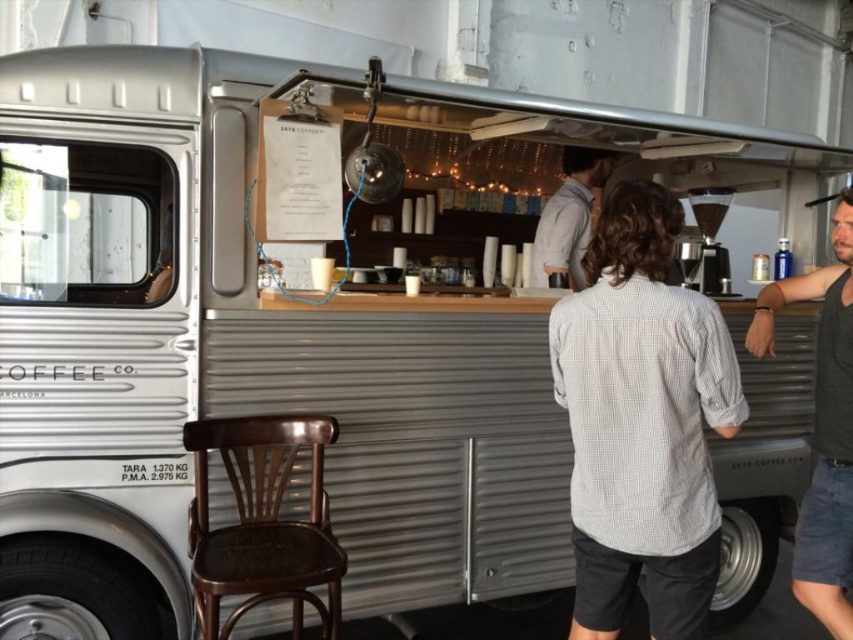
You are a customer standing at the counter of the coffee truck. You notice two staff members wearing different shirts. The one wearing the white checkered shirt at center is preparing your drink, while the other in the dark gray tank top at right is organizing the cups. Which staff member is closer to you?

The white checkered shirt at center is closer to you because it is in front of the dark gray tank top at right.

Looking at this image, you are a customer standing at the entrance of the coffee truck. You want to order a drink but need to know which shirt is closer to you. The shirts are the white checkered shirt at center and the gray cotton shirt at center. Which one is closer?

The white checkered shirt at center is 4.17 feet away from the gray cotton shirt at center, but the question is about which is closer to you. Since both shirts are at the center, their distance from you would depend on their position relative to the entrance. However, the given information does not specify their exact positions along the depth axis from the entrance. Without additional details about their depth placement, it is impossible to determine which shirt is closer to you.